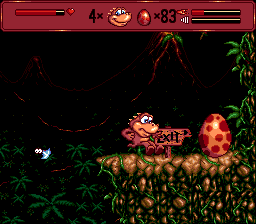
Find the location of a particular element. brown sign that says 'exit' in black font is located at coordinates (170, 142).